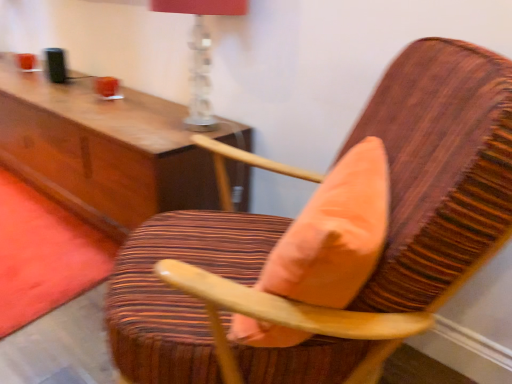
This screenshot has width=512, height=384. What do you see at coordinates (200, 53) in the screenshot?
I see `translucent glass table lamp at upper center` at bounding box center [200, 53].

Locate an element on the screen. coral velvet throw pillow at center is located at coordinates (335, 233).

Where is `translucent glass table lamp at upper center`? translucent glass table lamp at upper center is located at coordinates (200, 53).

From the image's perspective, is translucent glass table lamp at upper center positioned above or below wooden chair with striped upholstery at center?

Clearly, from the image's perspective, translucent glass table lamp at upper center is above wooden chair with striped upholstery at center.

Which point is more forward, [195,20] or [153,352]?

The point [153,352] is more forward.

Which object is thinner, translucent glass table lamp at upper center or wooden chair with striped upholstery at center?

Thinner between the two is translucent glass table lamp at upper center.

Could you tell me if translucent glass table lamp at upper center is facing wooden chair with striped upholstery at center?

No, translucent glass table lamp at upper center is not aimed at wooden chair with striped upholstery at center.

From a real-world perspective, does coral velvet throw pillow at center stand above wooden chair with striped upholstery at center?

Yes, from a real-world perspective, coral velvet throw pillow at center is above wooden chair with striped upholstery at center.

Considering their positions, is coral velvet throw pillow at center located in front of or behind wooden chair with striped upholstery at center?

coral velvet throw pillow at center is behind wooden chair with striped upholstery at center.

Is coral velvet throw pillow at center located outside wooden chair with striped upholstery at center?

No, coral velvet throw pillow at center is not outside of wooden chair with striped upholstery at center.

Considering the sizes of objects coral velvet throw pillow at center and wooden chair with striped upholstery at center in the image provided, who is wider, coral velvet throw pillow at center or wooden chair with striped upholstery at center?

Wider between the two is wooden chair with striped upholstery at center.

Are coral velvet throw pillow at center and translucent glass table lamp at upper center beside each other?

No, coral velvet throw pillow at center is not beside translucent glass table lamp at upper center.

In the image, is coral velvet throw pillow at center positioned in front of or behind translucent glass table lamp at upper center?

coral velvet throw pillow at center is positioned closer to the viewer than translucent glass table lamp at upper center.

Considering the positions of objects coral velvet throw pillow at center and translucent glass table lamp at upper center in the image provided, who is more to the left, coral velvet throw pillow at center or translucent glass table lamp at upper center?

Positioned to the left is translucent glass table lamp at upper center.

Is translucent glass table lamp at upper center located within coral velvet throw pillow at center?

Actually, translucent glass table lamp at upper center is outside coral velvet throw pillow at center.

From the picture: Which of these two, wooden chair with striped upholstery at center or translucent glass table lamp at upper center, is wider?

Wider between the two is wooden chair with striped upholstery at center.

Which of these two, wooden chair with striped upholstery at center or translucent glass table lamp at upper center, is smaller?

With smaller size is translucent glass table lamp at upper center.

From the image's perspective, between wooden chair with striped upholstery at center and translucent glass table lamp at upper center, which one is located above?

translucent glass table lamp at upper center appears higher in the image.

Is translucent glass table lamp at upper center spatially inside coral velvet throw pillow at center, or outside of it?

translucent glass table lamp at upper center exists outside the volume of coral velvet throw pillow at center.

From the image's perspective, is translucent glass table lamp at upper center on coral velvet throw pillow at center?

Yes, from the image's perspective, translucent glass table lamp at upper center is above coral velvet throw pillow at center.

Is translucent glass table lamp at upper center far away from coral velvet throw pillow at center?

No, translucent glass table lamp at upper center is not far from coral velvet throw pillow at center.

Can you confirm if translucent glass table lamp at upper center is shorter than coral velvet throw pillow at center?

Incorrect, the height of translucent glass table lamp at upper center does not fall short of that of coral velvet throw pillow at center.

Is there a large distance between wooden chair with striped upholstery at center and coral velvet throw pillow at center?

wooden chair with striped upholstery at center is near coral velvet throw pillow at center, not far away.

From a real-world perspective, does wooden chair with striped upholstery at center stand above coral velvet throw pillow at center?

No, from a real-world perspective, wooden chair with striped upholstery at center is not above coral velvet throw pillow at center.

Does point (463, 230) lie behind point (336, 235)?

Yes, point (463, 230) is behind point (336, 235).

How much distance is there between wooden chair with striped upholstery at center and coral velvet throw pillow at center?

They are 5.44 inches apart.

Locate an element on the screen. table lamp above the wooden chair with striped upholstery at center (from a real-world perspective) is located at coordinates (200, 53).

Identify the location of throw pillow above the wooden chair with striped upholstery at center (from the image's perspective). (335, 233).

Which object lies nearer to the anchor point coral velvet throw pillow at center, translucent glass table lamp at upper center or wooden chair with striped upholstery at center?

wooden chair with striped upholstery at center lies closer to coral velvet throw pillow at center than the other object.

Looking at this image, from the image, which object appears to be nearer to translucent glass table lamp at upper center, wooden chair with striped upholstery at center or coral velvet throw pillow at center?

wooden chair with striped upholstery at center.

Which object lies further to the anchor point wooden chair with striped upholstery at center, coral velvet throw pillow at center or translucent glass table lamp at upper center?

translucent glass table lamp at upper center is positioned further to the anchor wooden chair with striped upholstery at center.

Looking at this image, based on their spatial positions, is wooden chair with striped upholstery at center or translucent glass table lamp at upper center further from coral velvet throw pillow at center?

translucent glass table lamp at upper center lies further to coral velvet throw pillow at center than the other object.

Looking at this image, which object lies nearer to the anchor point translucent glass table lamp at upper center, coral velvet throw pillow at center or wooden chair with striped upholstery at center?

wooden chair with striped upholstery at center is closer to translucent glass table lamp at upper center.

Which object lies further to the anchor point wooden chair with striped upholstery at center, translucent glass table lamp at upper center or coral velvet throw pillow at center?

Result: Among the two, translucent glass table lamp at upper center is located further to wooden chair with striped upholstery at center.

At what (x,y) coordinates should I click in order to perform the action: click on throw pillow positioned between wooden chair with striped upholstery at center and translucent glass table lamp at upper center from near to far. Please return your answer as a coordinate pair (x, y). Looking at the image, I should click on (335, 233).